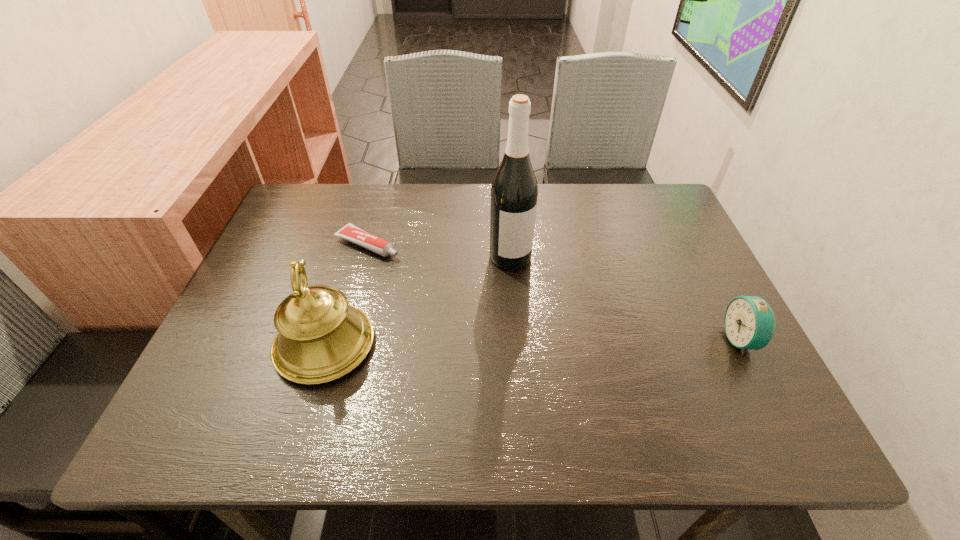
Locate an element on the screen. The width and height of the screenshot is (960, 540). free space located on the label of the tallest object is located at coordinates (541, 323).

What are the coordinates of `vacant space located on the label of the tallest object` in the screenshot? It's located at (546, 333).

Where is `free space located on the label of the tallest object`? free space located on the label of the tallest object is located at coordinates (526, 291).

This screenshot has height=540, width=960. I want to click on vacant space located at the nozzle of the shortest object, so click(425, 267).

Locate an element on the screen. vacant position located at the nozzle of the shortest object is located at coordinates (528, 315).

This screenshot has height=540, width=960. In order to click on vacant space located at the nozzle of the shortest object in this screenshot , I will do `click(476, 291)`.

Locate an element on the screen. object that is positioned at the far edge is located at coordinates (349, 232).

Find the location of a particular element. bell present at the near edge is located at coordinates (320, 338).

Find the location of a particular element. alarm clock present at the near edge is located at coordinates pyautogui.click(x=749, y=322).

The height and width of the screenshot is (540, 960). I want to click on object situated at the left edge, so click(320, 338).